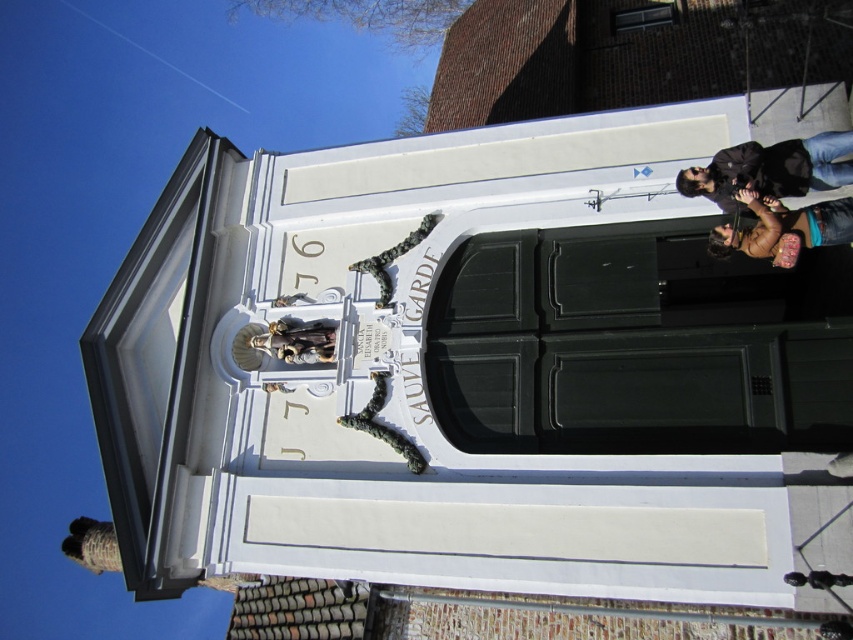
You are a GUI agent. You are given a task and a screenshot of the screen. Output one action in this format:
    pyautogui.click(x=<x>, y=<y>)
    Task: Click on the black leather jacket at upper right
    This screenshot has height=640, width=853.
    Given the screenshot: What is the action you would take?
    pyautogui.click(x=770, y=170)

Is point (735, 147) positioned after point (837, 225)?

Yes, point (735, 147) is behind point (837, 225).

Between point (822, 136) and point (712, 253), which one is positioned behind?

The point (712, 253) is more distant.

Identify the location of black leather jacket at upper right. The width and height of the screenshot is (853, 640). (770, 170).